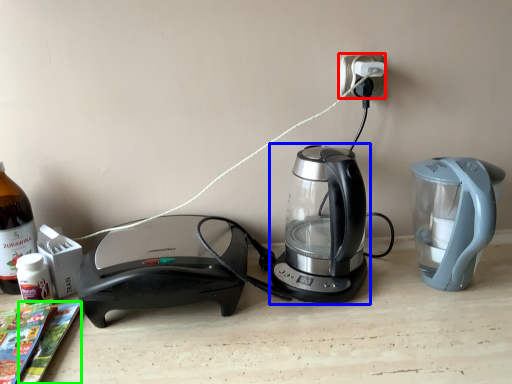
Question: Considering the real-world distances, which object is farthest from electric outlet (highlighted by a red box)? kettle (highlighted by a blue box) or magazine (highlighted by a green box)?

Choices:
 (A) kettle
 (B) magazine

Answer: (B)